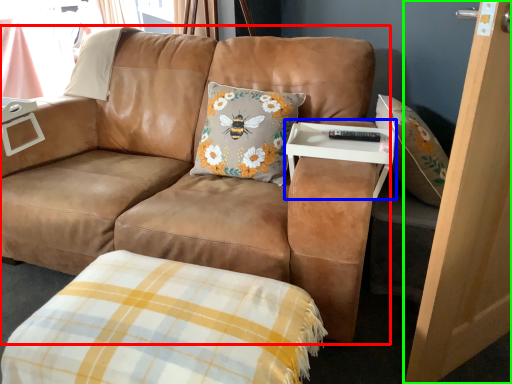
Question: Based on their relative distances, which object is nearer to studio couch (highlighted by a red box)? Choose from table (highlighted by a blue box) and screen door (highlighted by a green box).

Choices:
 (A) table
 (B) screen door

Answer: (A)